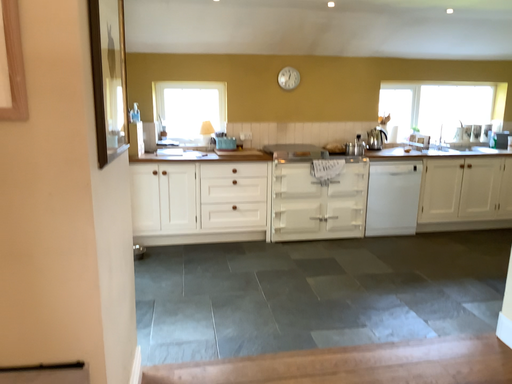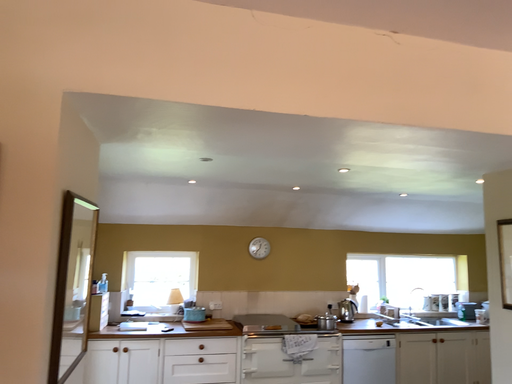
Question: Which way did the camera rotate in the video?

Choices:
 (A) rotated upward
 (B) rotated downward

Answer: (A)